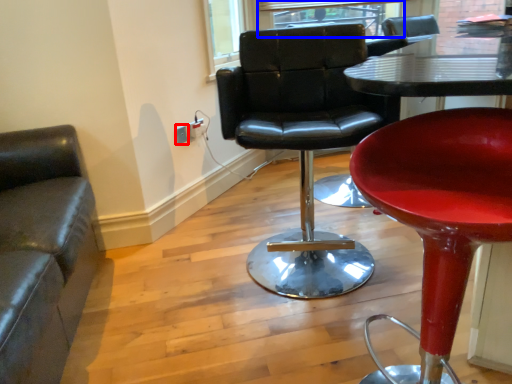
Question: Which of the following is the farthest to the observer, electric outlet (highlighted by a red box) or window (highlighted by a blue box)?

Choices:
 (A) electric outlet
 (B) window

Answer: (B)